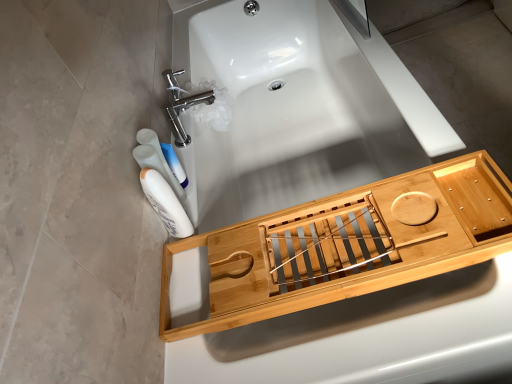
Question: Do you think natural wood bath caddy at lower right is within white glossy bottle at lower left, which ranks as the second mouthwash in front-to-back order, or outside of it?

Choices:
 (A) outside
 (B) inside

Answer: (A)

Question: From the image's perspective, is natural wood bath caddy at lower right above or below white glossy bottle at lower left, which ranks as the second mouthwash in front-to-back order?

Choices:
 (A) above
 (B) below

Answer: (B)

Question: Which of these objects is positioned farthest from the natural wood bath tray at center?

Choices:
 (A) white glossy bottle at lower left, which ranks as the second mouthwash in front-to-back order
 (B) polished chrome faucet at upper left
 (C) white glossy mouthwash at left, which is the 1th mouthwash from front to back
 (D) natural wood bath caddy at lower right

Answer: (C)

Question: Estimate the real-world distances between objects in this image. Which object is farther from the natural wood bath caddy at lower right?

Choices:
 (A) white glossy mouthwash at left, which is the 1th mouthwash from front to back
 (B) white glossy bottle at lower left, which ranks as the second mouthwash in front-to-back order
 (C) natural wood bath tray at center
 (D) polished chrome faucet at upper left

Answer: (D)